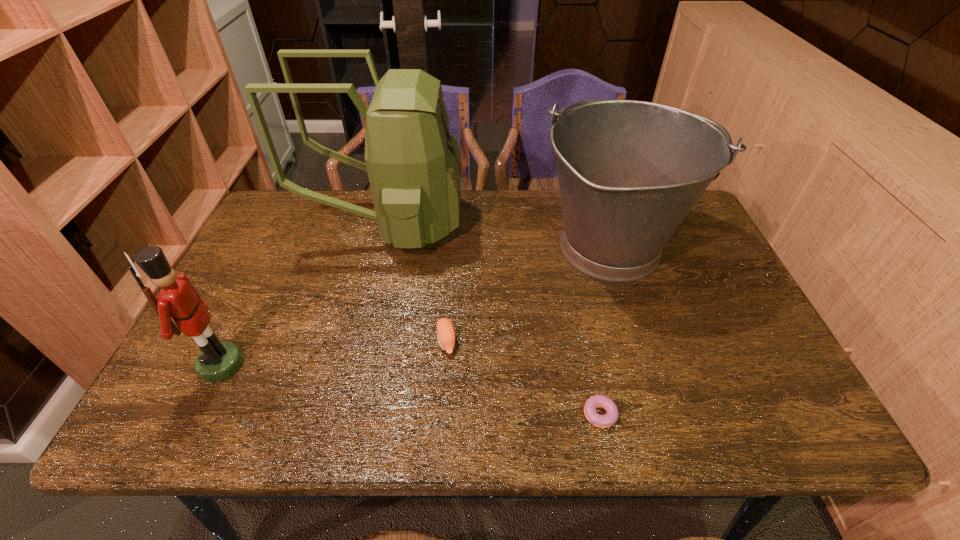
In the image, there is a desktop. Where is `vacant space at the far left corner`? vacant space at the far left corner is located at coordinates (283, 231).

This screenshot has width=960, height=540. What are the coordinates of `vacant space at the far right corner` in the screenshot? It's located at (692, 219).

The image size is (960, 540). I want to click on free spot between the nearest object and the backpack, so click(492, 319).

At what (x,y) coordinates should I click in order to perform the action: click on empty location between the shortest object and the bucket. Please return your answer as a coordinate pair (x, y). The image size is (960, 540). Looking at the image, I should click on (604, 331).

Find the location of a particular element. unoccupied position between the fourth tallest object and the nutcracker is located at coordinates 334,353.

In order to click on vacant area that lies between the doughnut and the leftmost object in this screenshot , I will do `click(409, 389)`.

Identify the location of vacant area between the bucket and the nutcracker. (416, 306).

This screenshot has height=540, width=960. I want to click on unoccupied position between the shortest object and the backpack, so click(492, 319).

You are a GUI agent. You are given a task and a screenshot of the screen. Output one action in this format:
    pyautogui.click(x=<x>, y=<y>)
    Task: Click on the free spot between the nearest object and the leftmost object
    
    Given the screenshot: What is the action you would take?
    pyautogui.click(x=409, y=389)

Find the location of `free spot between the backpack and the nearest object`. free spot between the backpack and the nearest object is located at coordinates (492, 319).